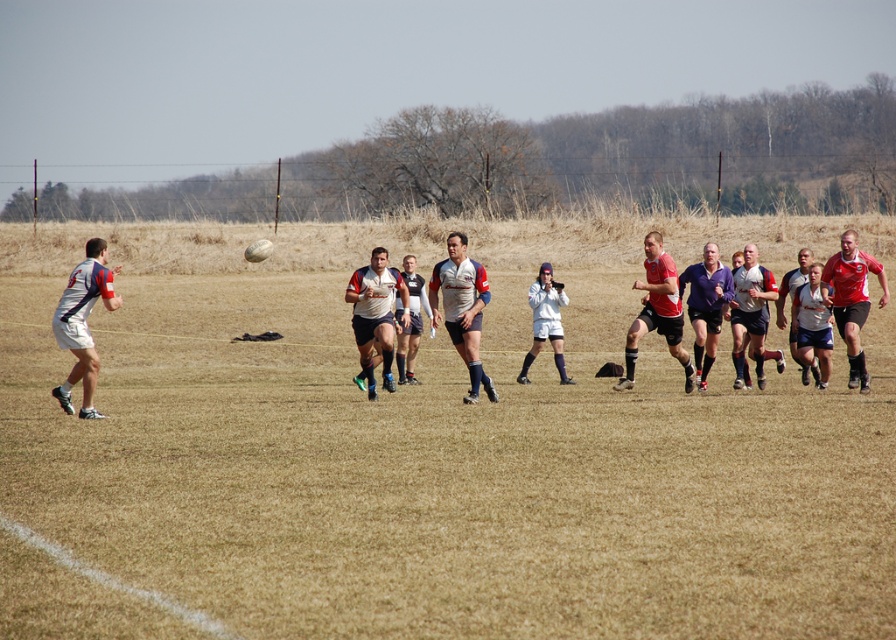
You are a player on the field during the rugby match. You need to find the brown grass at lower center. Based on its coordinates, which direction should you move to reach it?

The brown grass at lower center is located at point (448,472). Since the coordinates are based on the image, moving towards the lower center direction will lead you to it.

You are a photographer standing at the center of the field. You want to take a photo of the matte white rugby jersey at left. Which direction should you move to get the jersey into the frame?

The matte white rugby jersey at left is located at point 0.505 on the x axis and 0.094 on the y axis. Since you are at the center, you should move to the left to align the jersey within the frame.

You are a referee observing the rugby match. You notice the matte white rugby ball at center and the purple matte shorts at center. From your viewpoint, which object is positioned more to the left?

The matte white rugby ball at center is positioned to the left of the purple matte shorts at center, so it is more to the left.